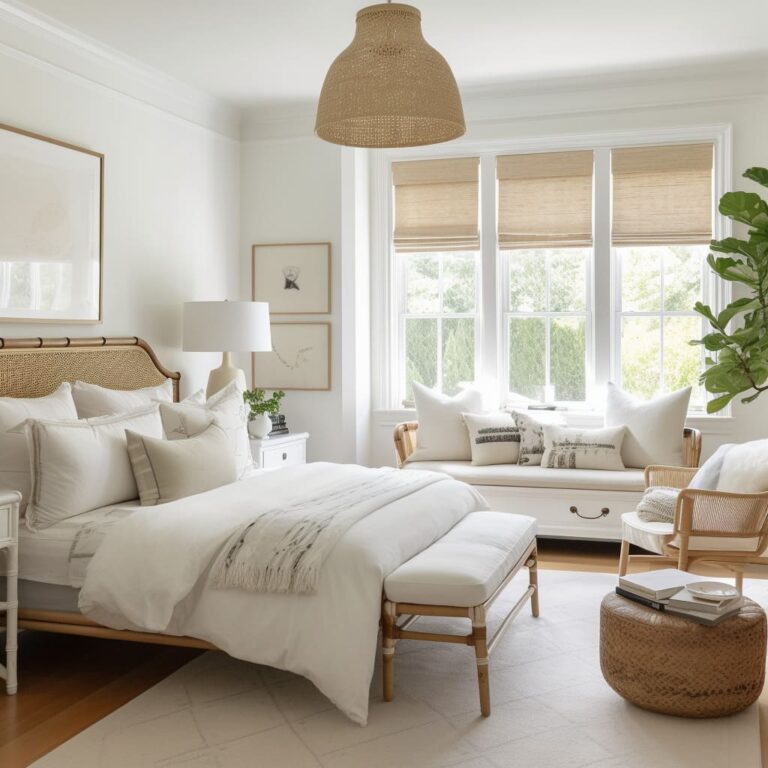
You are a GUI agent. You are given a task and a screenshot of the screen. Output one action in this format:
    pyautogui.click(x=<x>, y=<y>)
    Task: Click on the white chair
    The width and height of the screenshot is (768, 768).
    Given the screenshot: What is the action you would take?
    pyautogui.click(x=717, y=514)